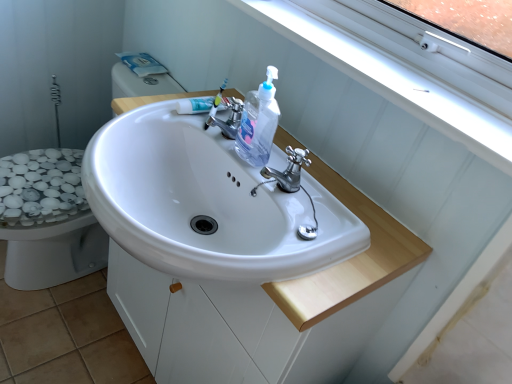
Question: Is clear plastic bottle at center taller or shorter than chrome metallic faucet at center, which appears as the 2th tap when viewed from the front?

Choices:
 (A) short
 (B) tall

Answer: (B)

Question: Is clear plastic bottle at center inside or outside of chrome metallic faucet at center, marked as the first tap in a left-to-right arrangement?

Choices:
 (A) outside
 (B) inside

Answer: (A)

Question: Which object is the closest to the polished chrome faucet at center, the second tap positioned from the back?

Choices:
 (A) white glossy sink at center
 (B) white glossy bidet at lower left
 (C) chrome metallic faucet at center, positioned as the second tap in bottom-to-top order
 (D) white plastic window frame at upper right
 (E) clear plastic bottle at center

Answer: (E)

Question: Based on their relative distances, which object is farther from the white glossy sink at center?

Choices:
 (A) white glossy bidet at lower left
 (B) polished chrome faucet at center, the second tap positioned from the back
 (C) chrome metallic faucet at center, the 1th tap when ordered from top to bottom
 (D) white plastic window frame at upper right
 (E) white plastic toothbrush at center

Answer: (A)